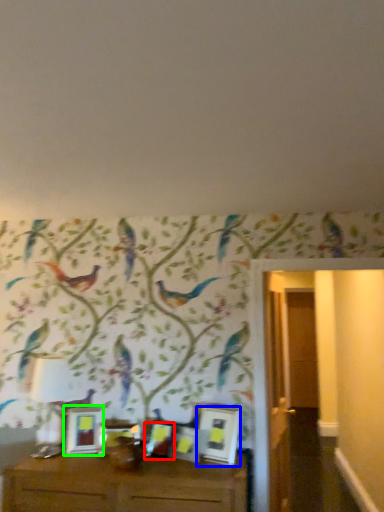
Question: Estimate the real-world distances between objects in this image. Which object is farther from picture frame (highlighted by a red box), picture frame (highlighted by a blue box) or picture frame (highlighted by a green box)?

Choices:
 (A) picture frame
 (B) picture frame

Answer: (B)